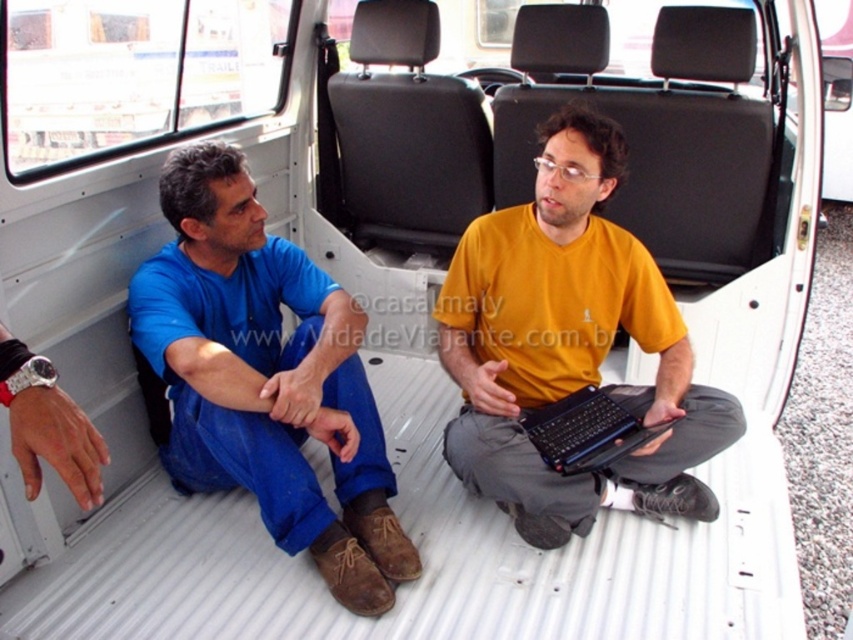
Question: Considering the real-world distances, which object is farthest from the black plastic laptop at center?

Choices:
 (A) blue denim jeans at lower left
 (B) yellow matte shirt at center

Answer: (A)

Question: Is blue denim jeans at lower left below yellow matte shirt at center?

Choices:
 (A) no
 (B) yes

Answer: (B)

Question: Does yellow matte shirt at center have a greater width compared to black plastic laptop at center?

Choices:
 (A) yes
 (B) no

Answer: (A)

Question: Which of the following is the farthest from the observer?

Choices:
 (A) black plastic laptop at center
 (B) blue denim jeans at lower left
 (C) yellow matte shirt at center

Answer: (A)

Question: Which point appears closest to the camera in this image?

Choices:
 (A) (308, 532)
 (B) (476, 348)

Answer: (A)

Question: Where is blue denim jeans at lower left located in relation to black plastic laptop at center in the image?

Choices:
 (A) right
 (B) left

Answer: (B)